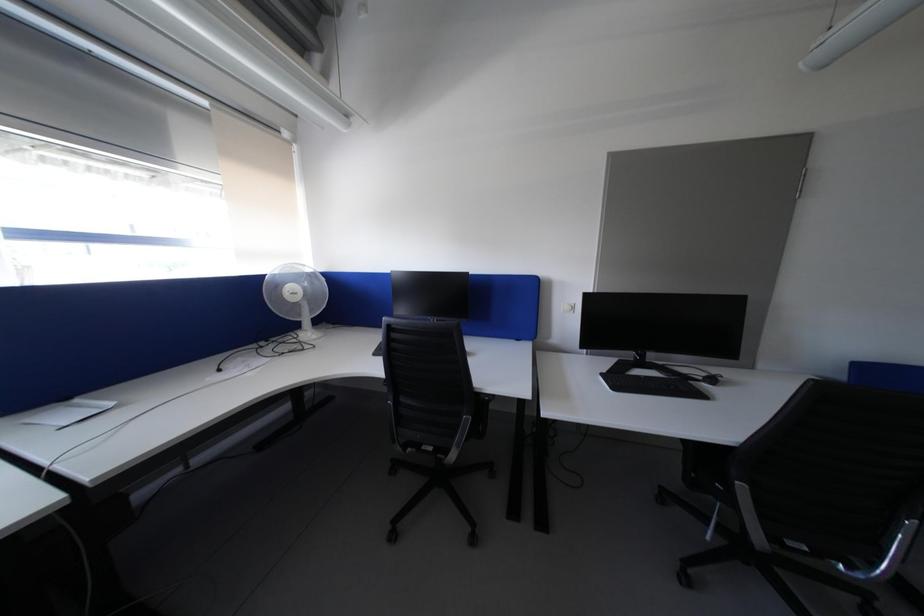
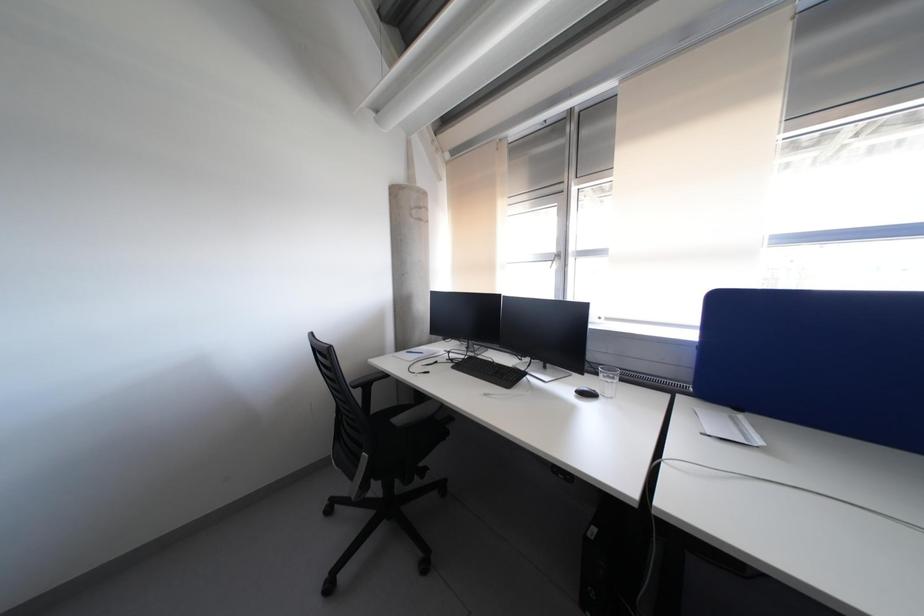
Question: The camera is either moving clockwise (left) or counter-clockwise (right) around the object. The first image is from the beginning of the video and the second image is from the end. Is the camera moving left or right when shooting the video?

Choices:
 (A) Left
 (B) Right

Answer: (B)